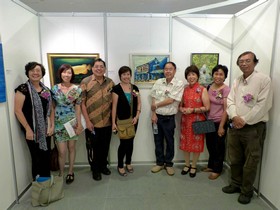
Locate an element on the screen. The width and height of the screenshot is (280, 210). hanging frames is located at coordinates (80, 61), (147, 62), (204, 62), (1, 82).